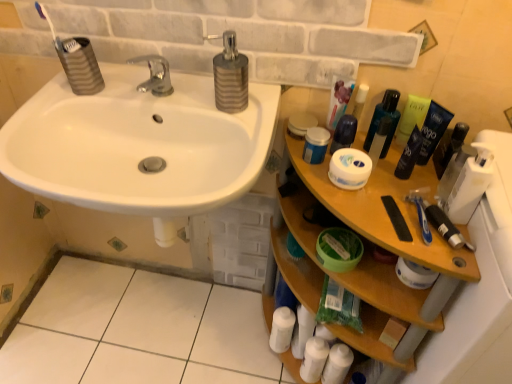
Identify the location of vacant area that lies between blue plastic toothbrush at right, positioned as the first toothbrush in front-to-back order, and white matte jar at upper right, which ranks as the 3th toiletry in left-to-right order. This screenshot has width=512, height=384. (398, 194).